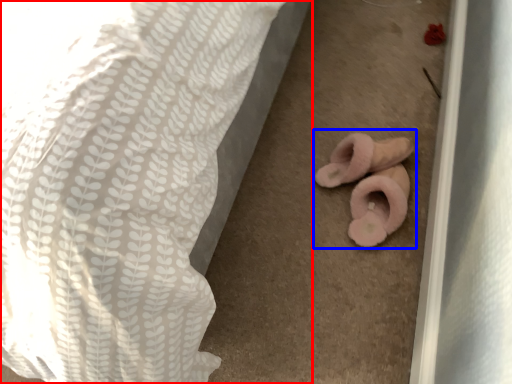
Question: Which of the following is the farthest to the observer, bed (highlighted by a red box) or stuff (highlighted by a blue box)?

Choices:
 (A) bed
 (B) stuff

Answer: (B)